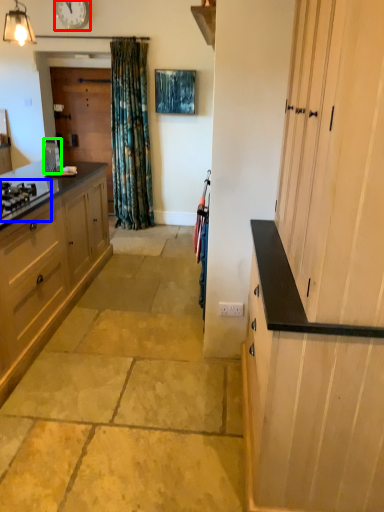
Question: Estimate the real-world distances between objects in this image. Which object is closer to clock (highlighted by a red box), gas stove (highlighted by a blue box) or appliance (highlighted by a green box)?

Choices:
 (A) gas stove
 (B) appliance

Answer: (B)